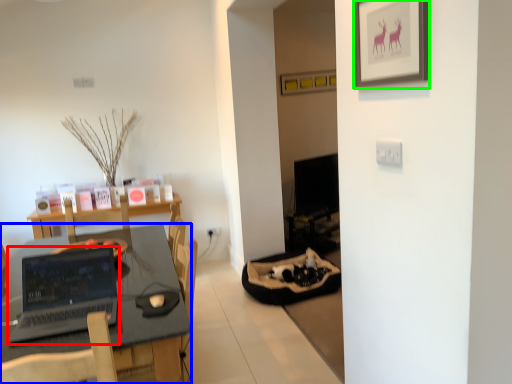
Question: Considering the real-world distances, which object is closest to laptop (highlighted by a red box)? desk (highlighted by a blue box) or picture frame (highlighted by a green box).

Choices:
 (A) desk
 (B) picture frame

Answer: (A)